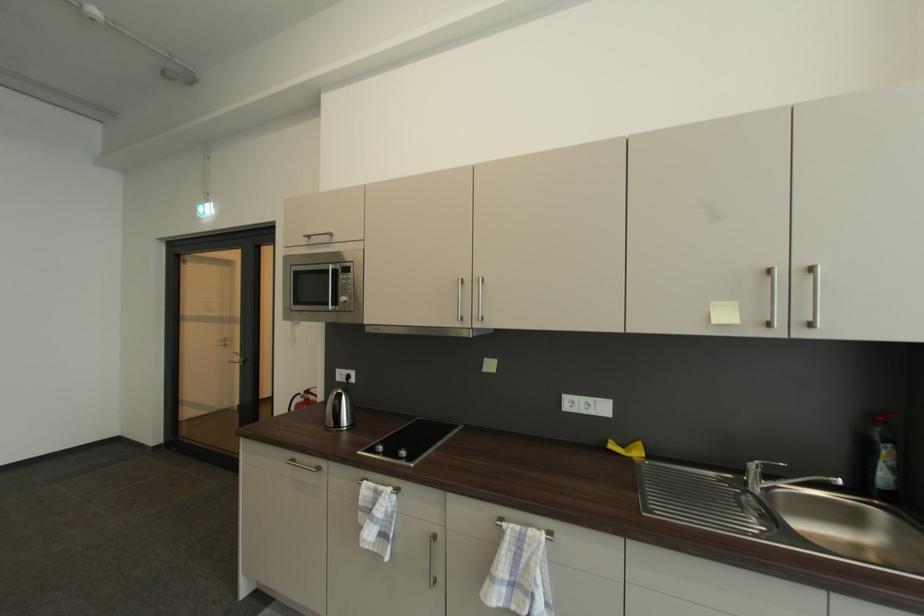
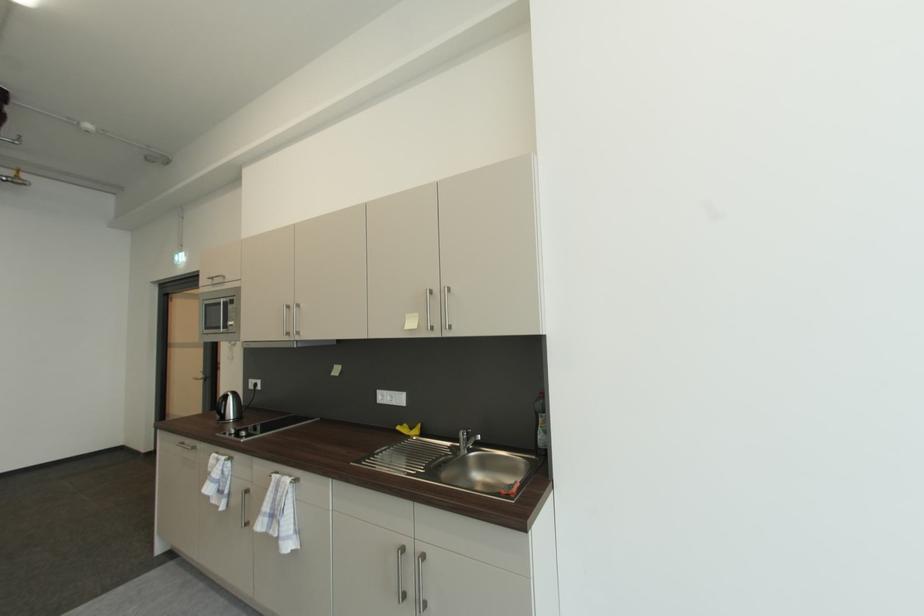
Find the pixel in the second image that matches the point at 888,466 in the first image.

(545, 430)